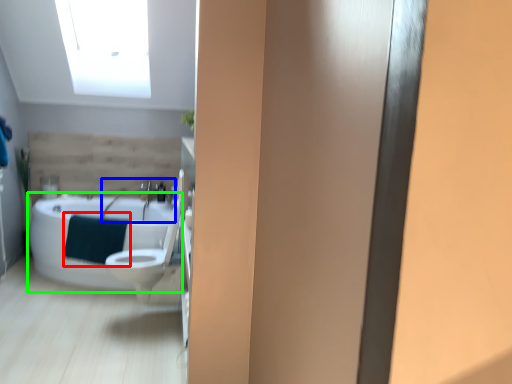
Question: Which is farther away from bath towel (highlighted by a red box)? sink (highlighted by a blue box) or bathtub (highlighted by a green box)?

Choices:
 (A) sink
 (B) bathtub

Answer: (A)